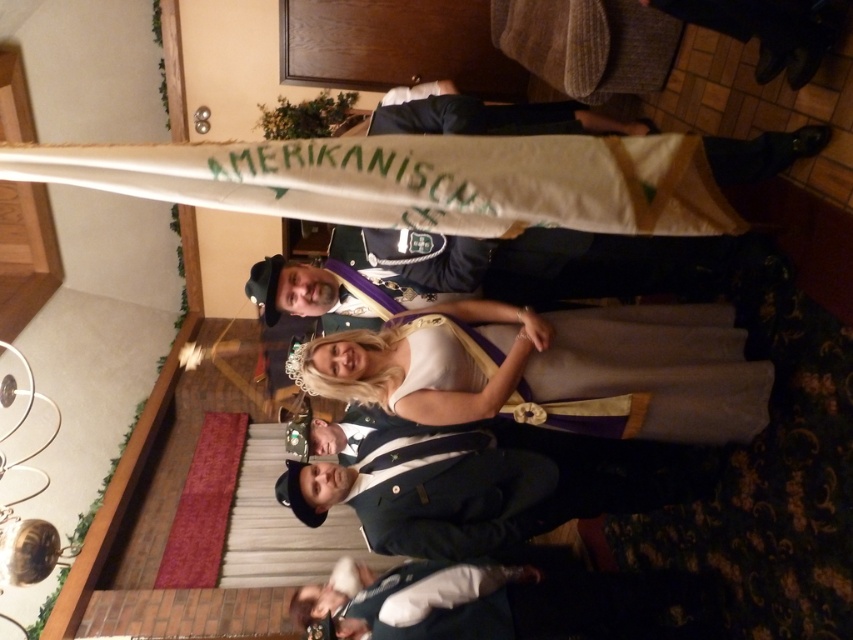
Is point (520, 352) behind point (457, 513)?

No, it is in front of (457, 513).

Who is more forward, (320, 362) or (390, 440)?

Point (320, 362)

What do you see at coordinates (554, 371) in the screenshot?
I see `white satin dress at center` at bounding box center [554, 371].

I want to click on white satin dress at center, so click(x=554, y=371).

How much distance is there between white satin dress at center and shiny gold chain at center?

13.33 inches

Is white satin dress at center to the right of shiny gold chain at center from the viewer's perspective?

Yes, white satin dress at center is to the right of shiny gold chain at center.

Is point (392, 362) behind point (386, 230)?

No, it is in front of (386, 230).

You are a GUI agent. You are given a task and a screenshot of the screen. Output one action in this format:
    pyautogui.click(x=<x>, y=<y>)
    Task: Click on the white satin dress at center
    The width and height of the screenshot is (853, 640).
    Given the screenshot: What is the action you would take?
    pyautogui.click(x=554, y=371)

Describe the element at coordinates (492, 484) in the screenshot. This screenshot has width=853, height=640. I see `dark blue suit at center` at that location.

Who is higher up, dark blue suit at center or shiny gold chain at center?

shiny gold chain at center is higher up.

Identify the location of dark blue suit at center. (492, 484).

Where is `dark blue suit at center`? The height and width of the screenshot is (640, 853). dark blue suit at center is located at coordinates (492, 484).